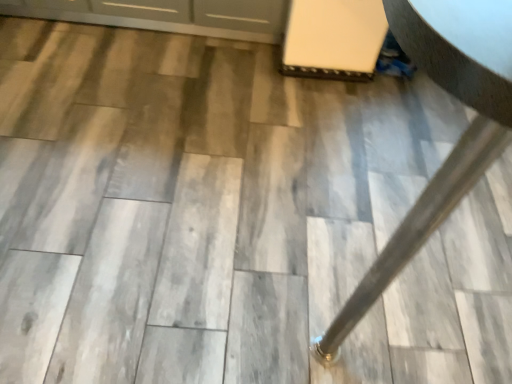
Identify the location of vacant area situated below metallic pole at lower right (from a real-world perspective). (330, 216).